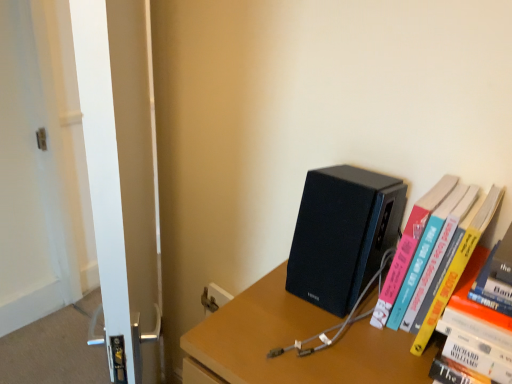
I want to click on free location in front of black matte speaker at center-right, so click(329, 343).